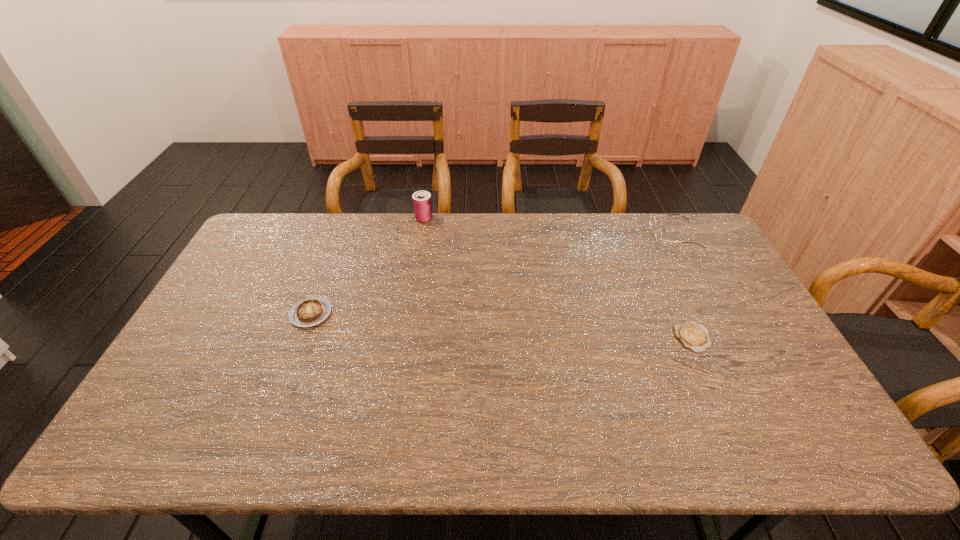
In the image, there is a desktop. Find the location of `vacant area at the near left corner`. vacant area at the near left corner is located at coordinates (186, 421).

In order to click on free space at the far right corner of the desktop in this screenshot , I will do `click(705, 241)`.

Identify the location of free region at the near right corner of the desktop. The width and height of the screenshot is (960, 540). (844, 454).

Where is `empty location between the third object from right to left and the right quiche`? Image resolution: width=960 pixels, height=540 pixels. empty location between the third object from right to left and the right quiche is located at coordinates click(x=558, y=278).

Identify the location of unoccupied position between the tallest object and the second shortest object. (368, 266).

This screenshot has height=540, width=960. I want to click on unoccupied position between the right quiche and the third shortest object, so click(684, 286).

Locate an element on the screen. The height and width of the screenshot is (540, 960). free area in between the right quiche and the second tallest object is located at coordinates (684, 286).

Identify the location of vacant region between the taller quiche and the shortest object. Image resolution: width=960 pixels, height=540 pixels. (501, 326).

This screenshot has width=960, height=540. Identify the location of empty space that is in between the third shortest object and the taller quiche. (492, 274).

The width and height of the screenshot is (960, 540). What are the coordinates of `vacant area that lies between the taller quiche and the spectacles` in the screenshot? It's located at (492, 274).